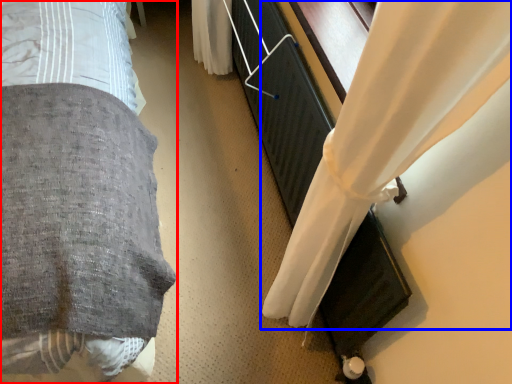
Question: Which object is further to the camera taking this photo, bed (highlighted by a red box) or curtain (highlighted by a blue box)?

Choices:
 (A) bed
 (B) curtain

Answer: (B)